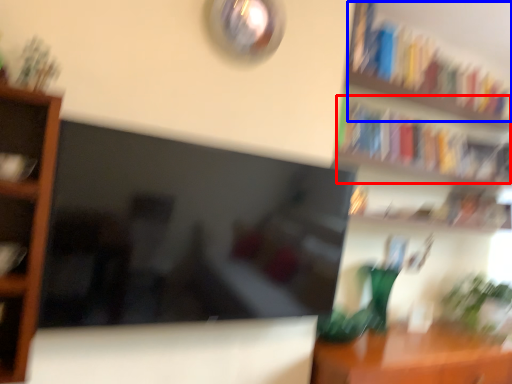
Question: Which point is further to the camera, book (highlighted by a red box) or book (highlighted by a blue box)?

Choices:
 (A) book
 (B) book

Answer: (A)